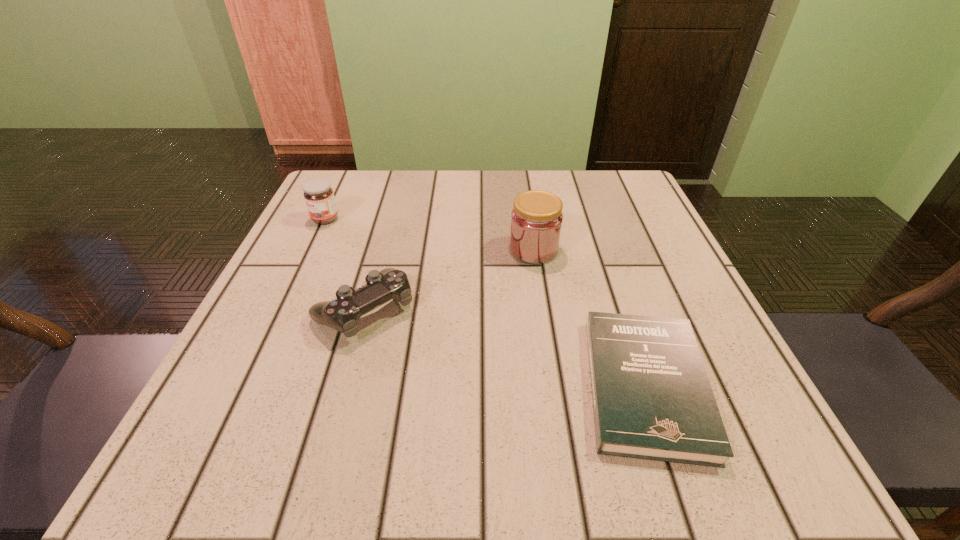
Find the location of a particular element. vacant space located 0.340m on the left of the shortest object is located at coordinates (346, 386).

Image resolution: width=960 pixels, height=540 pixels. I want to click on object that is at the far edge, so click(319, 197).

At what (x,y) coordinates should I click in order to perform the action: click on object at the near edge. Please return your answer as a coordinate pair (x, y). This screenshot has width=960, height=540. Looking at the image, I should click on (652, 399).

Where is `jam present at the left edge`? jam present at the left edge is located at coordinates (319, 197).

This screenshot has width=960, height=540. In order to click on control present at the left edge in this screenshot , I will do `click(342, 314)`.

Locate an element on the screen. This screenshot has width=960, height=540. object that is at the right edge is located at coordinates (652, 399).

Locate an element on the screen. The width and height of the screenshot is (960, 540). object that is positioned at the far left corner is located at coordinates click(x=319, y=197).

The height and width of the screenshot is (540, 960). In order to click on object that is at the near right corner in this screenshot , I will do `click(652, 399)`.

Find the location of a particular element. This screenshot has width=960, height=540. blank space at the far edge of the desktop is located at coordinates (467, 188).

In the image, there is a desktop. At what (x,y) coordinates should I click in order to perform the action: click on vacant space at the near edge. Please return your answer as a coordinate pair (x, y). Looking at the image, I should click on (608, 477).